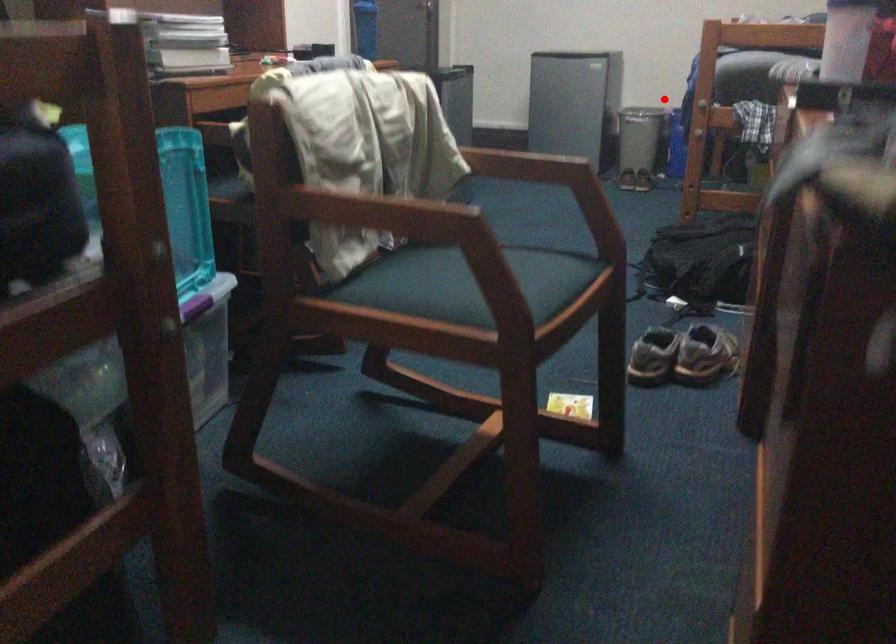
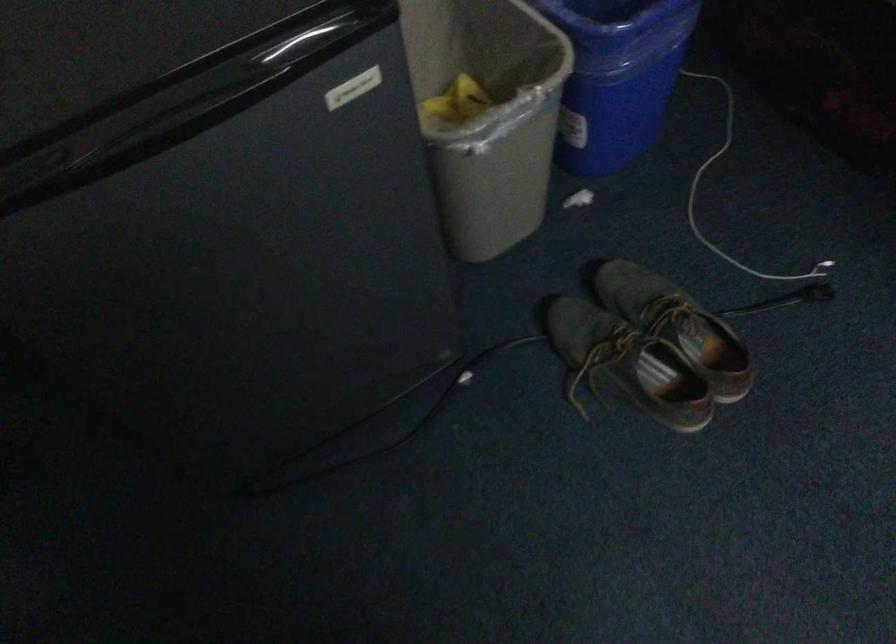
Question: I am providing you with two images of the same scene from different viewpoints. A red point is marked on the first image. Is the red point's position out of view in image 2?

Choices:
 (A) Yes
 (B) No

Answer: (B)